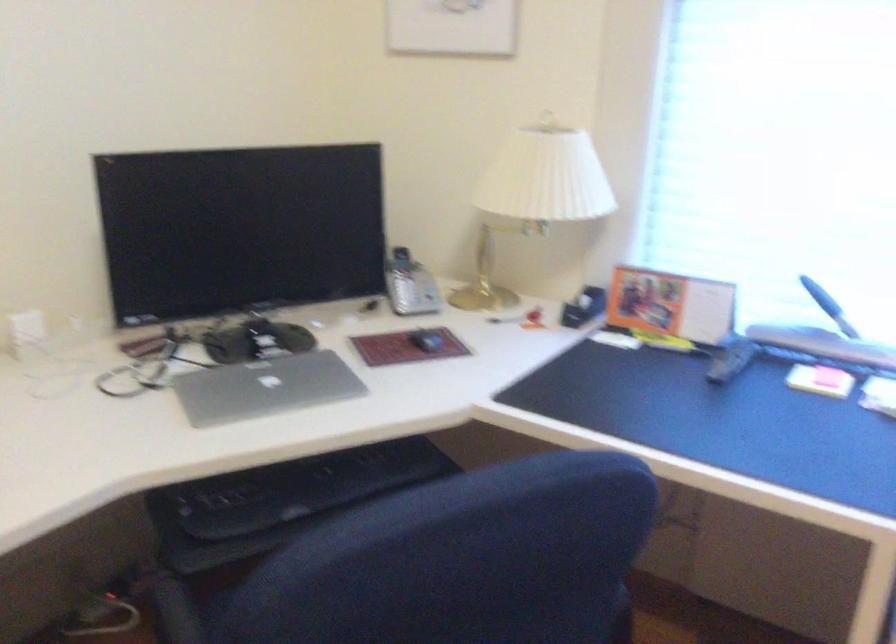
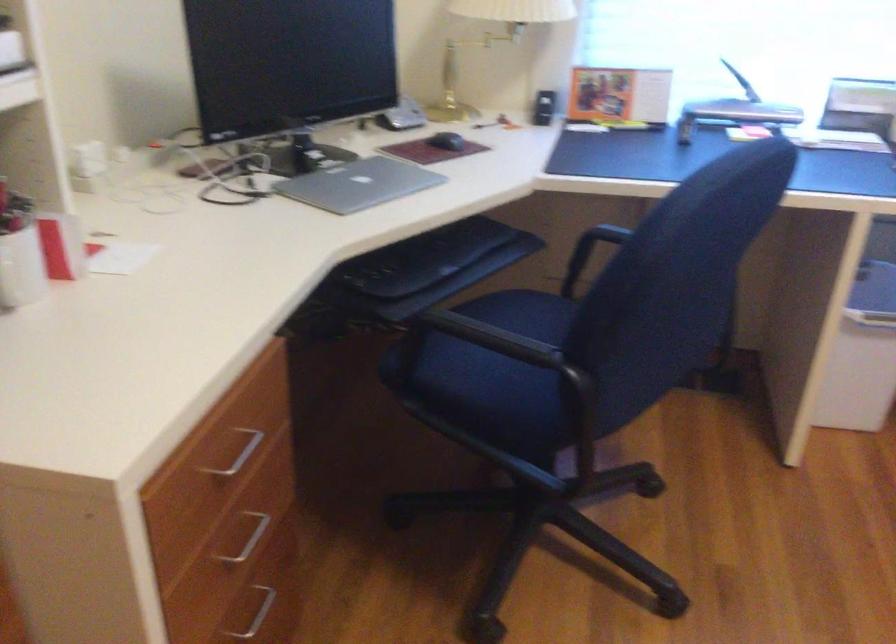
Find the pixel in the second image that matches point 417,341 in the first image.

(446, 140)